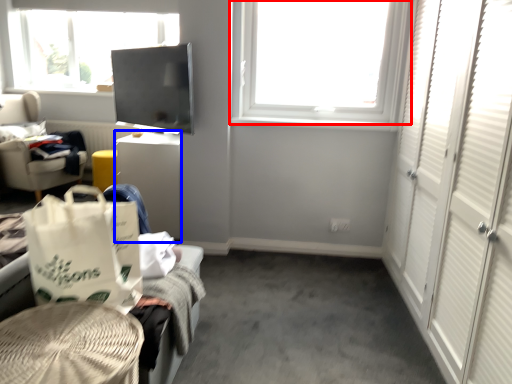
Question: Which point is further to the camera, window (highlighted by a red box) or desk (highlighted by a blue box)?

Choices:
 (A) window
 (B) desk

Answer: (B)